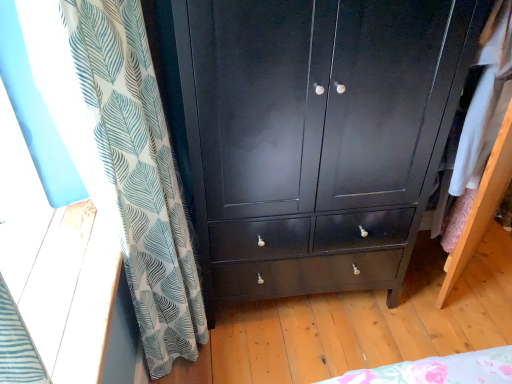
This screenshot has width=512, height=384. What do you see at coordinates (139, 175) in the screenshot?
I see `white leaf-patterned curtain at left` at bounding box center [139, 175].

At what (x,y) coordinates should I click in order to perform the action: click on white leaf-patterned curtain at left. Please return your answer as a coordinate pair (x, y). The image size is (512, 384). Looking at the image, I should click on (139, 175).

Describe the element at coordinates (309, 133) in the screenshot. I see `glossy black cabinet at center` at that location.

This screenshot has width=512, height=384. Identify the location of glossy black cabinet at center. (309, 133).

This screenshot has width=512, height=384. I want to click on white leaf-patterned curtain at left, so click(x=139, y=175).

Considering the relative positions of glossy black cabinet at center and white leaf-patterned curtain at left in the image provided, is glossy black cabinet at center to the left of white leaf-patterned curtain at left from the viewer's perspective?

No, glossy black cabinet at center is not to the left of white leaf-patterned curtain at left.

Based on the photo, relative to white leaf-patterned curtain at left, is glossy black cabinet at center in front or behind?

In the image, glossy black cabinet at center appears behind white leaf-patterned curtain at left.

Is point (396, 54) positioned before point (118, 195)?

That is False.

Based on the photo, from the image's perspective, is glossy black cabinet at center above white leaf-patterned curtain at left?

Yes, from the image's perspective, glossy black cabinet at center is above white leaf-patterned curtain at left.

From a real-world perspective, is glossy black cabinet at center on top of white leaf-patterned curtain at left?

No.

Which of these two, glossy black cabinet at center or white leaf-patterned curtain at left, is wider?

With larger width is glossy black cabinet at center.

Can you confirm if glossy black cabinet at center is taller than white leaf-patterned curtain at left?

No.

Looking at this image, considering the relative sizes of glossy black cabinet at center and white leaf-patterned curtain at left in the image provided, is glossy black cabinet at center bigger than white leaf-patterned curtain at left?

Yes.

Is glossy black cabinet at center located outside white leaf-patterned curtain at left?

glossy black cabinet at center lies outside white leaf-patterned curtain at left's area.

Are glossy black cabinet at center and white leaf-patterned curtain at left far apart?

They are positioned close to each other.

Based on the photo, could you tell me if glossy black cabinet at center is turned towards white leaf-patterned curtain at left?

No, glossy black cabinet at center is not oriented towards white leaf-patterned curtain at left.

What's the angular difference between glossy black cabinet at center and white leaf-patterned curtain at left's facing directions?

The angular difference between glossy black cabinet at center and white leaf-patterned curtain at left is 92.7 degrees.

How far apart are glossy black cabinet at center and white leaf-patterned curtain at left?

glossy black cabinet at center is 16.04 inches from white leaf-patterned curtain at left.

Locate an element on the screen. The width and height of the screenshot is (512, 384). curtain that appears below the glossy black cabinet at center (from the image's perspective) is located at coordinates (139, 175).

Which object is positioned more to the right, white leaf-patterned curtain at left or glossy black cabinet at center?

Positioned to the right is glossy black cabinet at center.

Between white leaf-patterned curtain at left and glossy black cabinet at center, which one is positioned in front?

white leaf-patterned curtain at left is more forward.

Does point (146, 346) appear closer or farther from the camera than point (463, 31)?

Point (146, 346) appears to be farther away from the viewer than point (463, 31).

From the picture: From the image's perspective, is white leaf-patterned curtain at left on top of glossy black cabinet at center?

Incorrect, from the image's perspective, white leaf-patterned curtain at left is lower than glossy black cabinet at center.

From a real-world perspective, is white leaf-patterned curtain at left on glossy black cabinet at center?

Indeed, from a real-world perspective, white leaf-patterned curtain at left stands above glossy black cabinet at center.

In terms of width, does white leaf-patterned curtain at left look wider or thinner when compared to glossy black cabinet at center?

white leaf-patterned curtain at left is thinner than glossy black cabinet at center.

Between white leaf-patterned curtain at left and glossy black cabinet at center, which one has less height?

With less height is glossy black cabinet at center.

Between white leaf-patterned curtain at left and glossy black cabinet at center, which one has smaller size?

white leaf-patterned curtain at left is smaller.

Is white leaf-patterned curtain at left surrounding glossy black cabinet at center?

No.

Based on the photo, is the surface of white leaf-patterned curtain at left in direct contact with glossy black cabinet at center?

No, white leaf-patterned curtain at left is not in contact with glossy black cabinet at center.

Is glossy black cabinet at center at the back of white leaf-patterned curtain at left?

Yes.

How far apart are white leaf-patterned curtain at left and glossy black cabinet at center?

They are 40.74 centimeters apart.

Locate an element on the screen. This screenshot has width=512, height=384. curtain in front of the glossy black cabinet at center is located at coordinates (139, 175).

Locate an element on the screen. This screenshot has height=384, width=512. chest of drawers below the white leaf-patterned curtain at left (from a real-world perspective) is located at coordinates pos(309,133).

Identify the location of curtain located above the glossy black cabinet at center (from a real-world perspective). (139, 175).